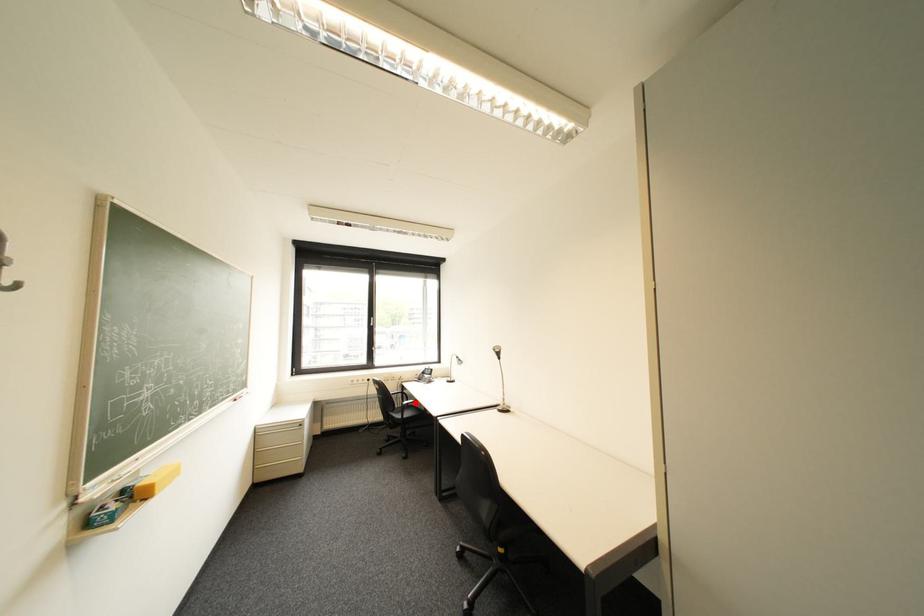
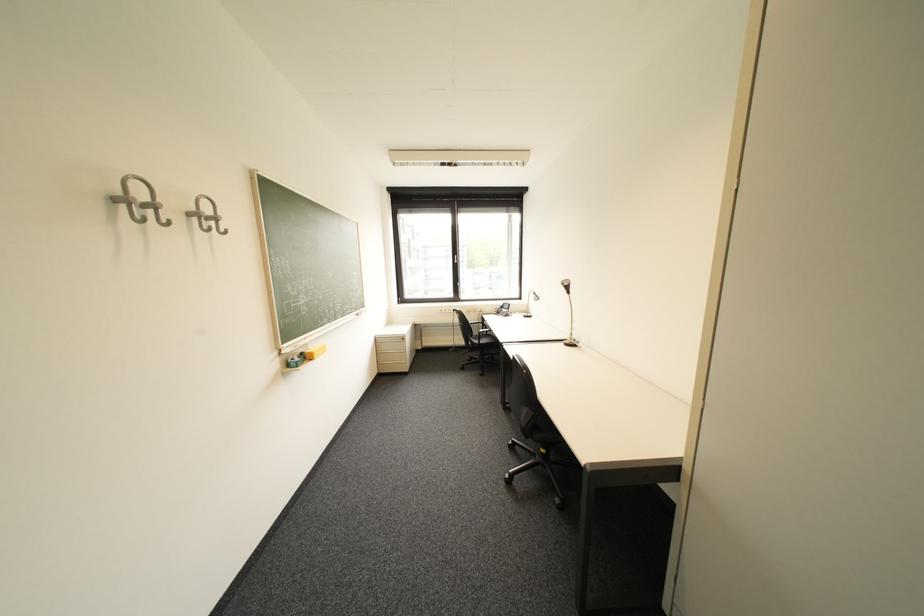
Question: I am providing you with two images of the same scene from different viewpoints. Given a red point in image1, look at the same physical point in image2. Is it:

Choices:
 (A) Closer to the viewpoint
 (B) Farther from the viewpoint

Answer: (A)